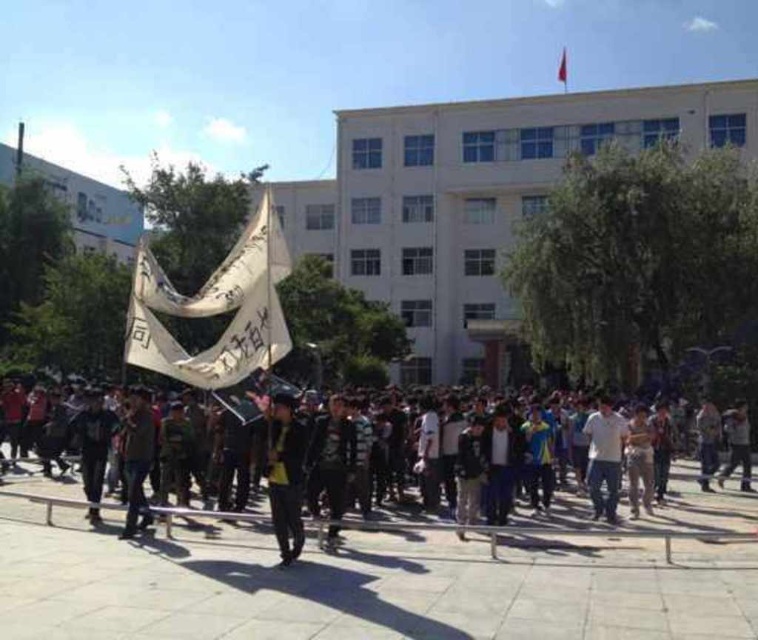
Question: Which of the following is the closest to the observer?

Choices:
 (A) (280, 458)
 (B) (459, 534)

Answer: (A)

Question: Can you confirm if dark gray fabric jacket at center is positioned to the left of red fabric flag at upper center?

Choices:
 (A) yes
 (B) no

Answer: (A)

Question: Which of the following is the farthest from the observer?

Choices:
 (A) (280, 438)
 (B) (71, 499)
 (C) (561, 72)

Answer: (C)

Question: Can you confirm if white paper banner at center is positioned above white matte shirt at center?

Choices:
 (A) no
 (B) yes

Answer: (B)

Question: Is dark gray fabric jacket at center below white matte shirt at center?

Choices:
 (A) yes
 (B) no

Answer: (B)

Question: Which point is closer to the camera?

Choices:
 (A) dark gray fabric jacket at center
 (B) white matte shirt at center
 (C) dark gray fabric crowd at center
 (D) white paper banner at center

Answer: (A)